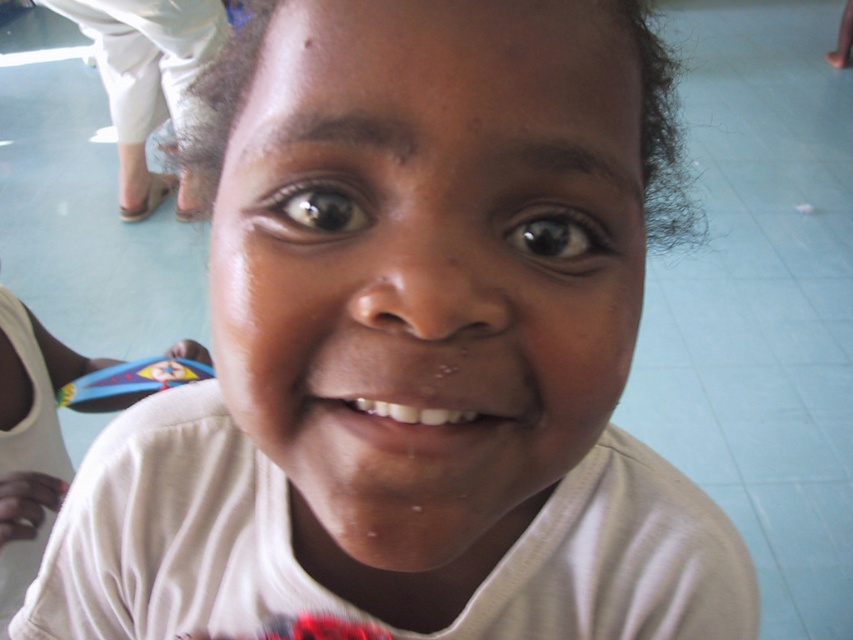
Question: Which of the following is the farthest from the observer?

Choices:
 (A) brown glossy eye at upper center
 (B) white glossy teeth at center
 (C) black glossy eye at center

Answer: (C)

Question: Is brown glossy eye at upper center to the right of black glossy eye at center from the viewer's perspective?

Choices:
 (A) no
 (B) yes

Answer: (A)

Question: Can you confirm if black glossy eye at center is bigger than white glossy teeth at center?

Choices:
 (A) yes
 (B) no

Answer: (B)

Question: Is brown glossy eye at upper center bigger than black glossy eye at center?

Choices:
 (A) yes
 (B) no

Answer: (B)

Question: Which of the following is the farthest from the observer?

Choices:
 (A) (119, 13)
 (B) (432, 428)
 (C) (596, 364)
 (D) (294, 214)

Answer: (A)

Question: Estimate the real-world distances between objects in this image. Which object is farther from the brown glossy eye at upper center?

Choices:
 (A) black glossy eye at center
 (B) white glossy teeth at center

Answer: (B)